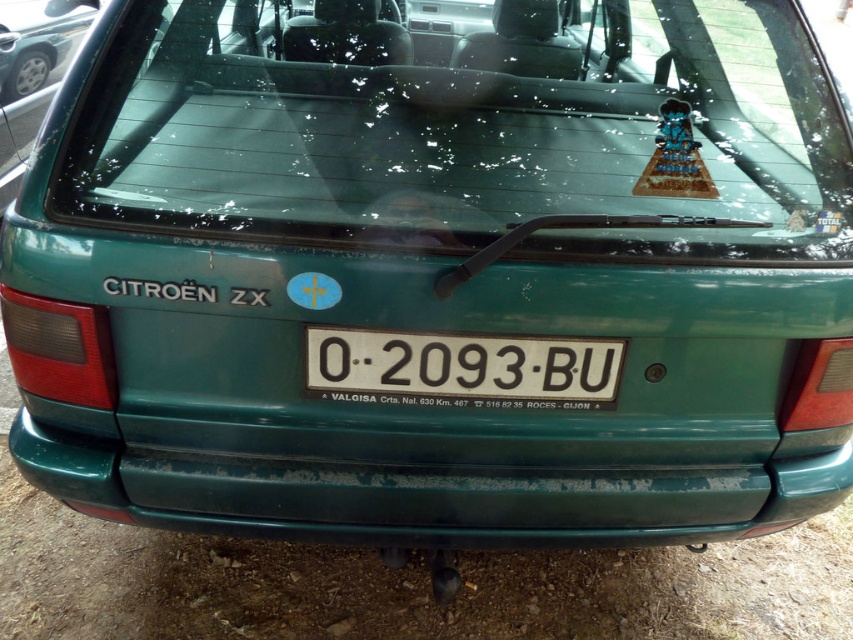
Who is positioned more to the right, green matte bumper at lower center or white plastic license plate at center?

white plastic license plate at center is more to the right.

Is green matte bumper at lower center thinner than white plastic license plate at center?

No.

At what (x,y) coordinates should I click in order to perform the action: click on green matte bumper at lower center. Please return your answer as a coordinate pair (x, y). The image size is (853, 640). Looking at the image, I should click on [422, 497].

In order to click on green matte bumper at lower center in this screenshot , I will do `click(422, 497)`.

Does point (399, 536) come in front of point (19, 58)?

Yes, point (399, 536) is closer to viewer.

Who is shorter, green matte bumper at lower center or green matte car at upper center?

Standing shorter between the two is green matte bumper at lower center.

Measure the distance between point (252,476) and camera.

They are 2.00 meters apart.

Image resolution: width=853 pixels, height=640 pixels. Find the location of `green matte bumper at lower center`. green matte bumper at lower center is located at coordinates (422, 497).

Which is more to the right, transparent glass windshield at upper center or white plastic license plate at center?

Positioned to the right is transparent glass windshield at upper center.

This screenshot has width=853, height=640. What are the coordinates of `transparent glass windshield at upper center` in the screenshot? It's located at (467, 124).

At what (x,y) coordinates should I click in order to perform the action: click on transparent glass windshield at upper center. Please return your answer as a coordinate pair (x, y). Looking at the image, I should click on point(467,124).

At what (x,y) coordinates should I click in order to perform the action: click on transparent glass windshield at upper center. Please return your answer as a coordinate pair (x, y). The width and height of the screenshot is (853, 640). Looking at the image, I should click on (467, 124).